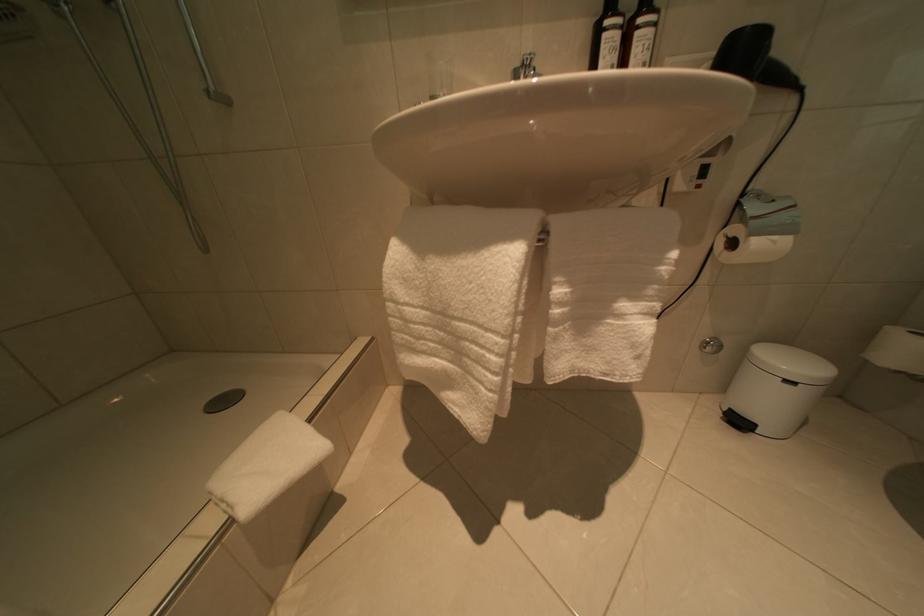
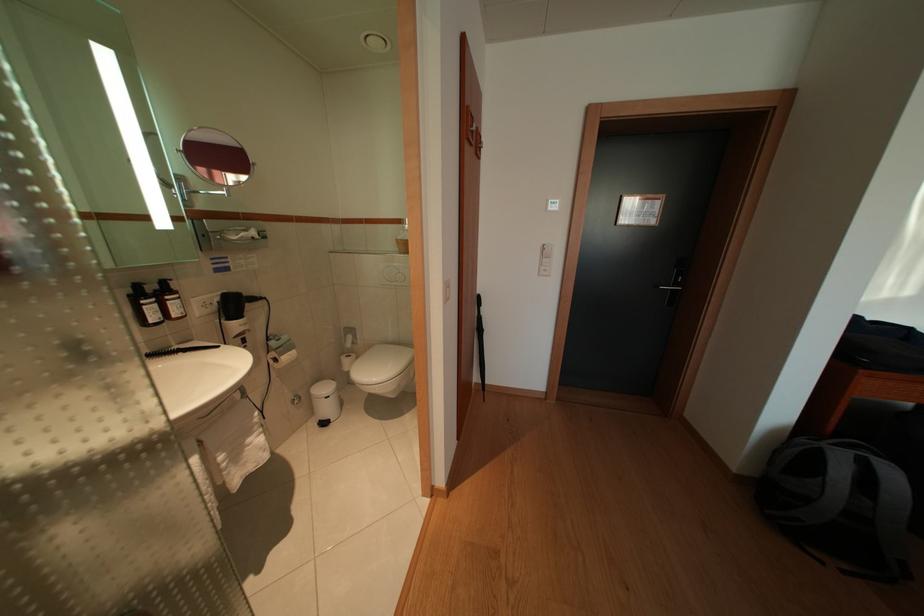
The point at (627, 41) is marked in the first image. Where is the corresponding point in the second image?

(164, 312)